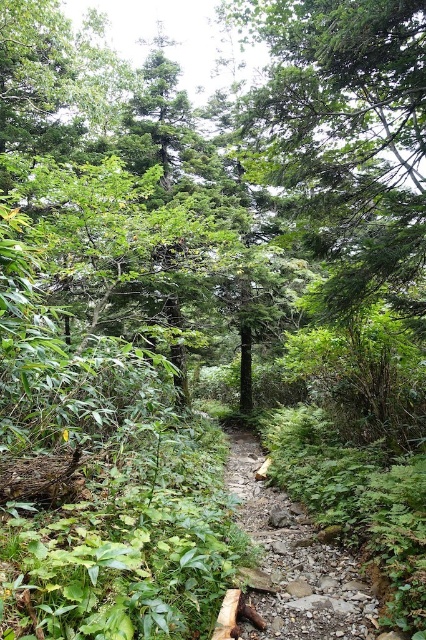
You are a hiker trying to navigate through the forest. You see the green leafy tree at center and the rough stone path at center. Which one is larger in size?

The green leafy tree at center is bigger than the rough stone path at center.